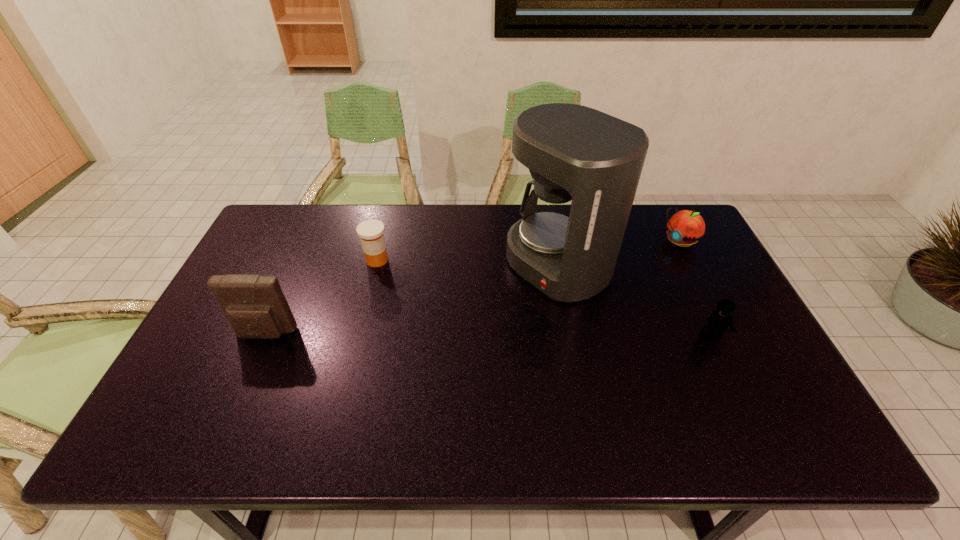
You are a GUI agent. You are given a task and a screenshot of the screen. Output one action in this format:
    pyautogui.click(x=<x>, y=<y>)
    Task: Click on the unoccupied position between the third object from left to right and the Lego
    
    Given the screenshot: What is the action you would take?
    pyautogui.click(x=635, y=301)

At what (x,y) coordinates should I click in order to perform the action: click on vacant area between the Lego and the third object from left to right. Please return your answer as a coordinate pair (x, y). The width and height of the screenshot is (960, 540). Looking at the image, I should click on (635, 301).

In order to click on vacant space in between the apple and the coffee maker in this screenshot , I will do `click(619, 254)`.

What are the coordinates of `vacant space in between the tallest object and the Lego` in the screenshot? It's located at (635, 301).

Locate an element on the screen. This screenshot has height=540, width=960. free space between the apple and the tallest object is located at coordinates (619, 254).

Locate an element on the screen. The image size is (960, 540). unoccupied area between the medicine and the second tallest object is located at coordinates (322, 297).

In order to click on vacant space that is in between the fourth object from right to left and the pouch in this screenshot , I will do [x=322, y=297].

Locate an element on the screen. free space that is in between the Lego and the medicine is located at coordinates (544, 298).

Locate an element on the screen. free space between the apple and the tallest object is located at coordinates (619, 254).

Select which object appears as the second closest to the third object from left to right. Please provide its 2D coordinates. Your answer should be formatted as a tuple, i.e. [(x, y)], where the tuple contains the x and y coordinates of a point satisfying the conditions above.

[(685, 227)]